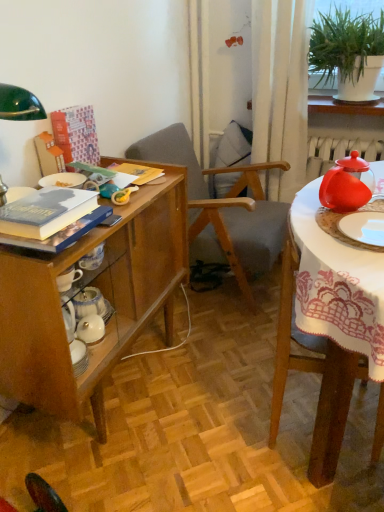
Question: Is shiny red teapot at right, marked as the 1th tableware in a top-to-bottom arrangement, to the left of hardcover book at left, which is counted as the 2th book, starting from the top, from the viewer's perspective?

Choices:
 (A) no
 (B) yes

Answer: (A)

Question: Is the surface of shiny red teapot at right, which ranks as the 2th tableware in bottom-to-top order, in direct contact with hardcover book at left, the second book from the back?

Choices:
 (A) yes
 (B) no

Answer: (B)

Question: Considering the relative sizes of shiny red teapot at right, which ranks as the 2th tableware in bottom-to-top order, and hardcover book at left, which is the first book in front-to-back order, in the image provided, is shiny red teapot at right, which ranks as the 2th tableware in bottom-to-top order, thinner than hardcover book at left, which is the first book in front-to-back order,?

Choices:
 (A) yes
 (B) no

Answer: (A)

Question: From the image's perspective, is shiny red teapot at right, marked as the 1th tableware in a top-to-bottom arrangement, under hardcover book at left, which is the first book in front-to-back order?

Choices:
 (A) no
 (B) yes

Answer: (A)

Question: Is shiny red teapot at right, which ranks as the 2th tableware in bottom-to-top order, wider than hardcover book at left, acting as the first book starting from the bottom?

Choices:
 (A) yes
 (B) no

Answer: (B)

Question: Does shiny red teapot at right, which ranks as the 2th tableware in bottom-to-top order, have a lesser height compared to hardcover book at left, the second book from the back?

Choices:
 (A) no
 (B) yes

Answer: (A)

Question: Can you confirm if shiny red teapot at right, marked as the 1th tableware in a top-to-bottom arrangement, is thinner than wooden desk at left?

Choices:
 (A) no
 (B) yes

Answer: (B)

Question: Is shiny red teapot at right, marked as the 1th tableware in a top-to-bottom arrangement, in contact with wooden desk at left?

Choices:
 (A) yes
 (B) no

Answer: (B)

Question: From a real-world perspective, is shiny red teapot at right, marked as the 1th tableware in a top-to-bottom arrangement, on top of wooden desk at left?

Choices:
 (A) yes
 (B) no

Answer: (A)

Question: Is shiny red teapot at right, which ranks as the 2th tableware in bottom-to-top order, looking in the opposite direction of wooden desk at left?

Choices:
 (A) yes
 (B) no

Answer: (B)

Question: From the image's perspective, is shiny red teapot at right, marked as the 1th tableware in a top-to-bottom arrangement, on top of wooden desk at left?

Choices:
 (A) yes
 (B) no

Answer: (A)

Question: Does shiny red teapot at right, marked as the 1th tableware in a top-to-bottom arrangement, lie behind wooden desk at left?

Choices:
 (A) yes
 (B) no

Answer: (A)

Question: Would you say wooden chair at right, the 1th chair positioned from the front, contains hardcover book at upper left, the first book positioned from the back?

Choices:
 (A) no
 (B) yes

Answer: (A)